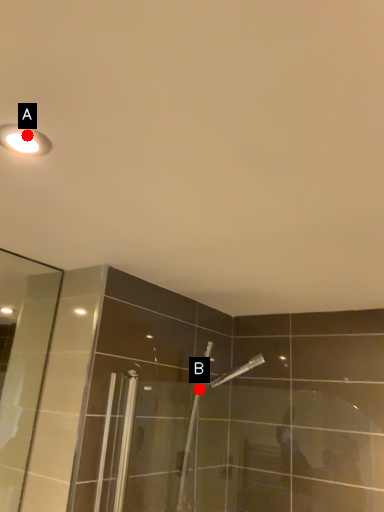
Question: Two points are circled on the image, labeled by A and B beside each circle. Which point is closer to the camera taking this photo?

Choices:
 (A) A is closer
 (B) B is closer

Answer: (A)